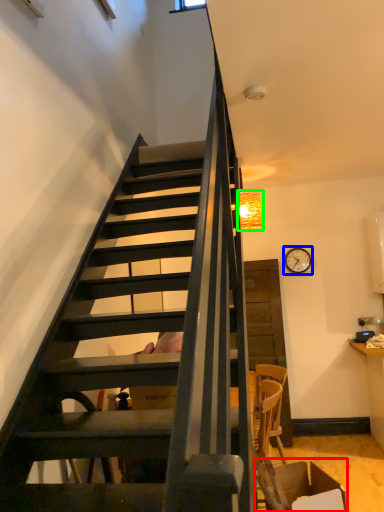
Question: Considering the real-world distances, which object is closest to armchair (highlighted by a red box)? clock (highlighted by a blue box) or lamp (highlighted by a green box).

Choices:
 (A) clock
 (B) lamp

Answer: (B)